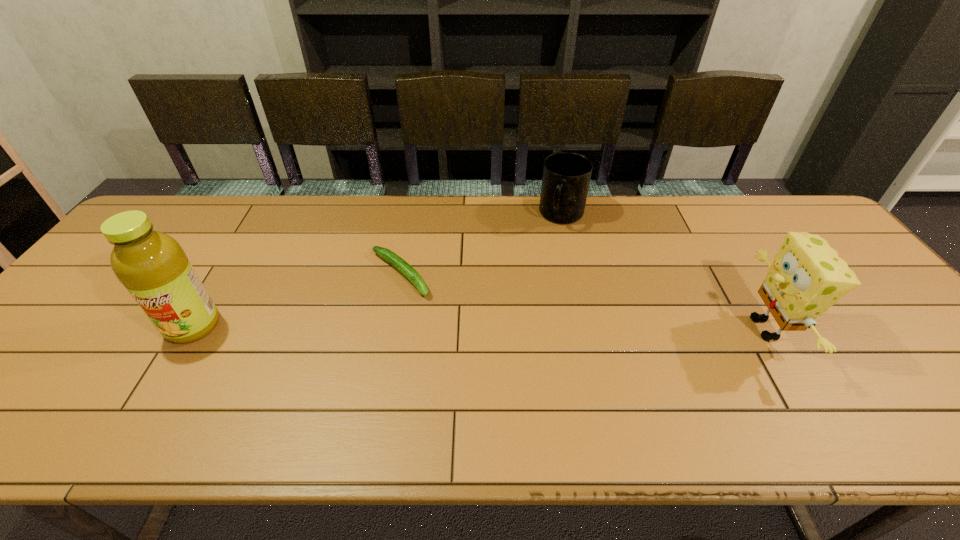
You are a GUI agent. You are given a task and a screenshot of the screen. Output one action in this format:
    pyautogui.click(x=<x>, y=<y>)
    Task: Click on the vacant space on the desktop that is between the fruit juice and the sponge and is positioned on the front-facing side of the zucchini
    
    Given the screenshot: What is the action you would take?
    pyautogui.click(x=458, y=327)

Locate an element on the screen. This screenshot has height=540, width=960. free space on the desktop that is between the leftmost object and the sponge and is positioned on the side of the farthest object with the handle is located at coordinates (512, 327).